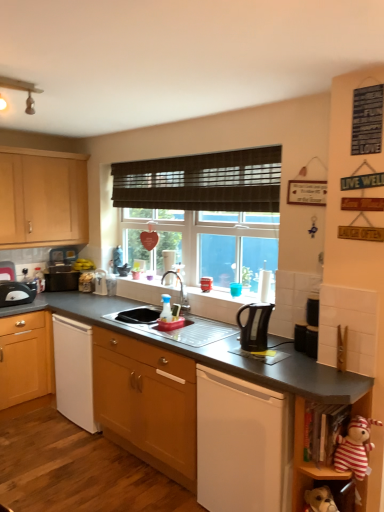
This screenshot has width=384, height=512. I want to click on vacant area that lies to the right of black plastic kettle at center, the second kitchen appliance positioned from the back, so click(x=289, y=348).